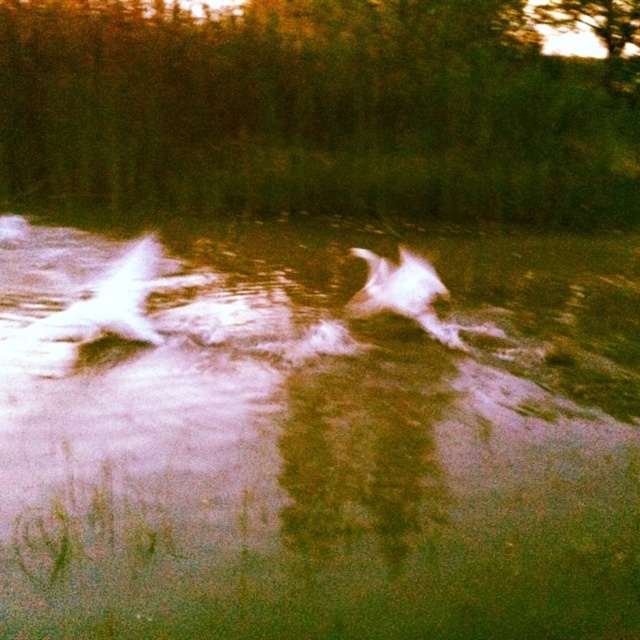
Question: Does white frothy water at center have a larger size compared to white fluffy dog at center?

Choices:
 (A) no
 (B) yes

Answer: (B)

Question: Where is white frothy water at center located in relation to white fluffy dog at center in the image?

Choices:
 (A) left
 (B) right

Answer: (A)

Question: Which of the following is the closest to the observer?

Choices:
 (A) (388, 296)
 (B) (230, 355)

Answer: (B)

Question: Does white frothy water at center have a greater width compared to white fluffy dog at center?

Choices:
 (A) no
 (B) yes

Answer: (B)

Question: Which of the following is the farthest from the observer?

Choices:
 (A) white frothy water at center
 (B) white fluffy dog at center

Answer: (B)